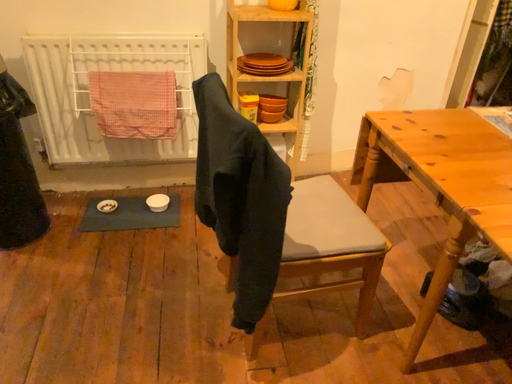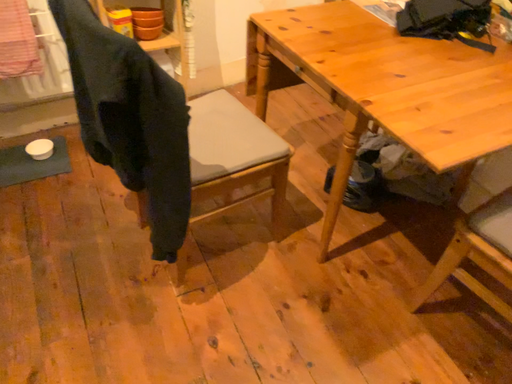
Question: How did the camera likely rotate when shooting the video?

Choices:
 (A) rotated left
 (B) rotated right

Answer: (B)